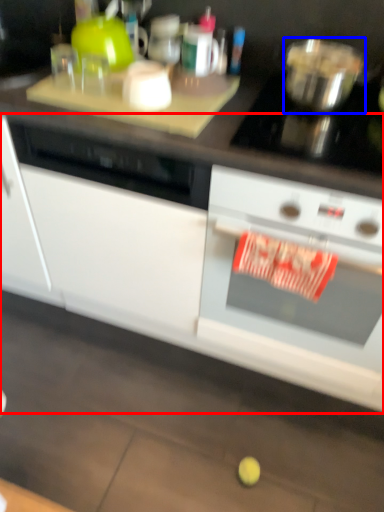
Question: Which point is closer to the camera, cabinetry (highlighted by a red box) or bowl (highlighted by a blue box)?

Choices:
 (A) cabinetry
 (B) bowl

Answer: (A)